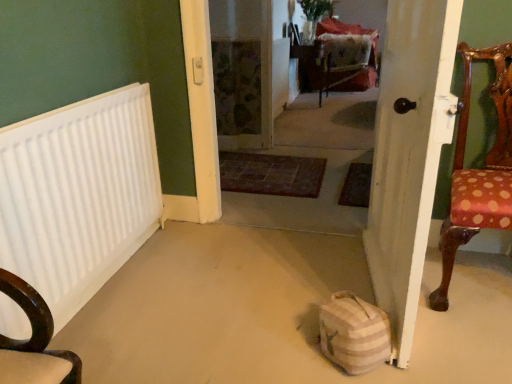
This screenshot has height=384, width=512. I want to click on vacant space situated on the left part of white wooden door at right, so click(x=260, y=294).